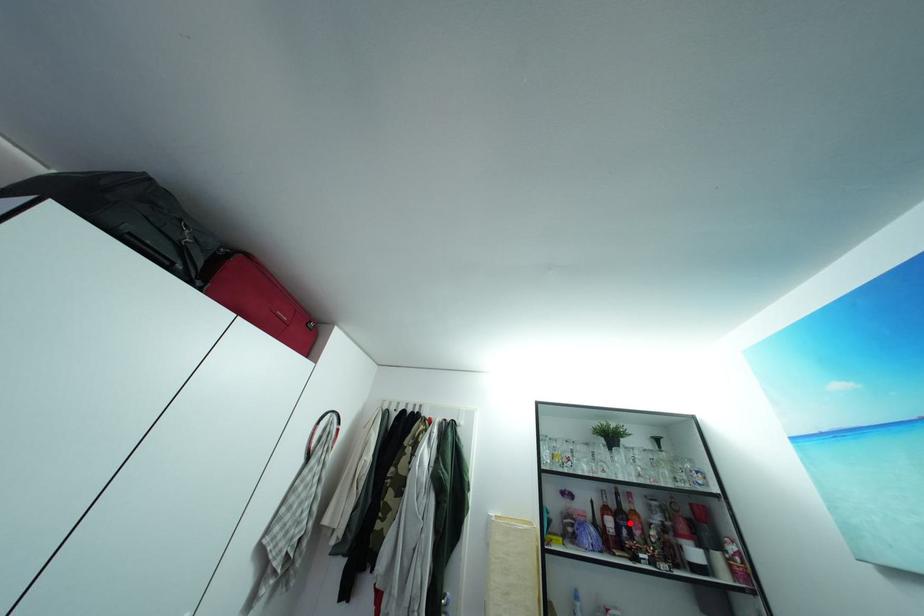
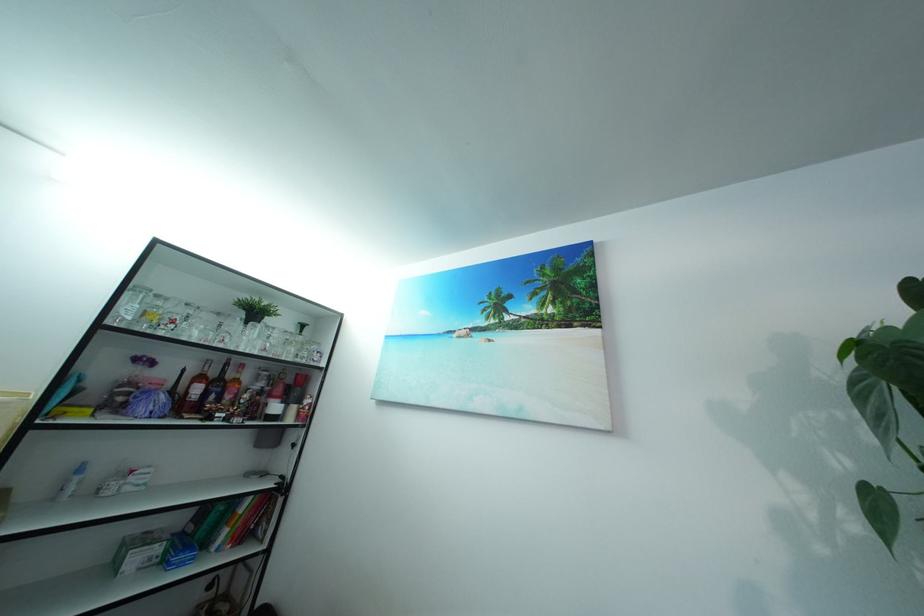
In the second image, find the point that corresponds to the highlighted location in the first image.

(226, 391)